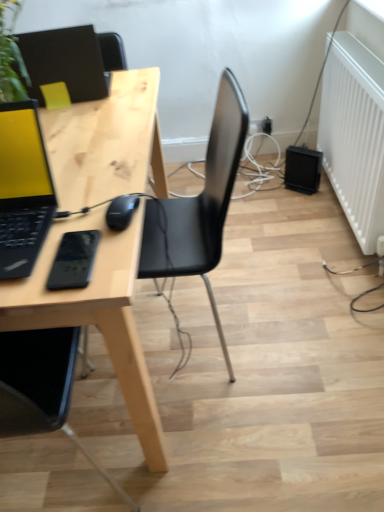
At what (x,y) coordinates should I click in order to perform the action: click on vacant area that lies between matte black laptop at upper left, which ranks as the 1th laptop in top-to-bottom order, and black matte mouse at center. Please return your answer as a coordinate pair (x, y). The height and width of the screenshot is (512, 384). Looking at the image, I should click on (104, 141).